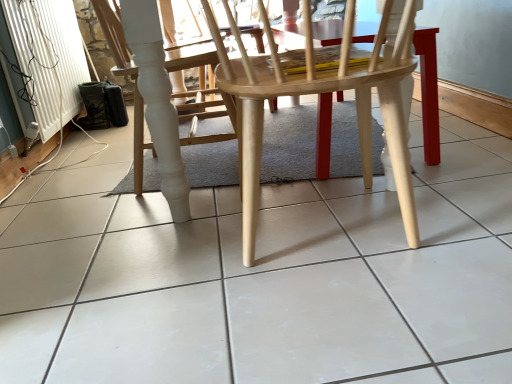
Question: From a real-world perspective, relative to white glossy tile at center, is natural wood chair at center, the first chair viewed from the front, vertically above or below?

Choices:
 (A) below
 (B) above

Answer: (B)

Question: Considering the relative positions of natural wood chair at center, the second chair when ordered from left to right, and white glossy tile at center in the image provided, is natural wood chair at center, the second chair when ordered from left to right, to the left or to the right of white glossy tile at center?

Choices:
 (A) right
 (B) left

Answer: (A)

Question: Which object is the closest to the natural wood chair at center, placed as the second chair when sorted from back to front?

Choices:
 (A) white glossy chair at center, the first chair viewed from the back
 (B) white glossy tile at center
 (C) white textured radiator at lower left

Answer: (B)

Question: Estimate the real-world distances between objects in this image. Which object is closer to the white glossy chair at center, arranged as the second chair when viewed from the front?

Choices:
 (A) white textured radiator at lower left
 (B) natural wood chair at center, placed as the second chair when sorted from back to front
 (C) white glossy tile at center

Answer: (B)